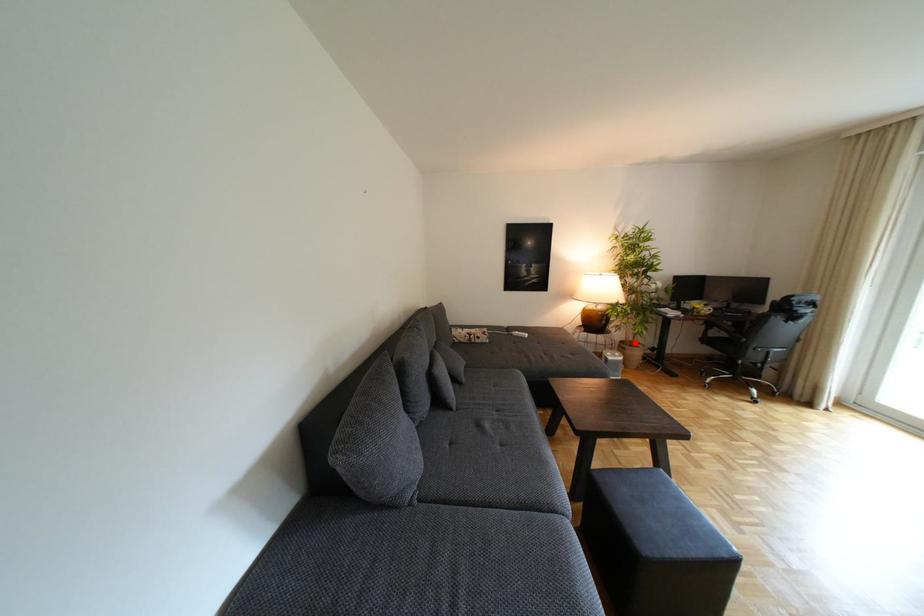
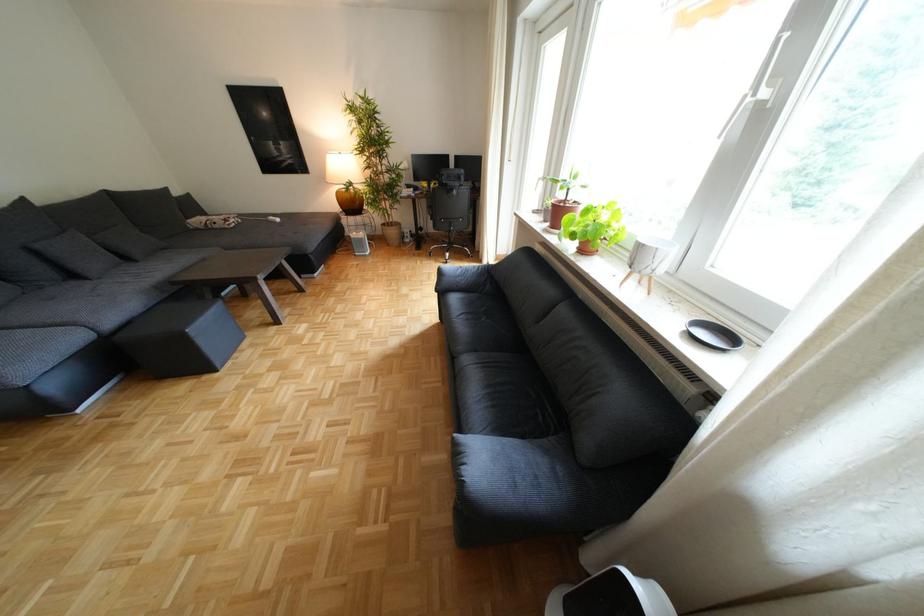
Question: I am providing you with two images of the same scene from different viewpoints. Given a red point in image1, look at the same physical point in image2. Is it:

Choices:
 (A) Closer to the viewpoint
 (B) Farther from the viewpoint

Answer: (A)